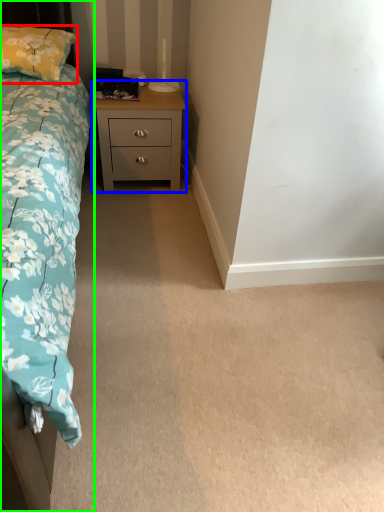
Question: Based on their relative distances, which object is nearer to pillow (highlighted by a red box)? Choose from nightstand (highlighted by a blue box) and bed (highlighted by a green box).

Choices:
 (A) nightstand
 (B) bed

Answer: (A)